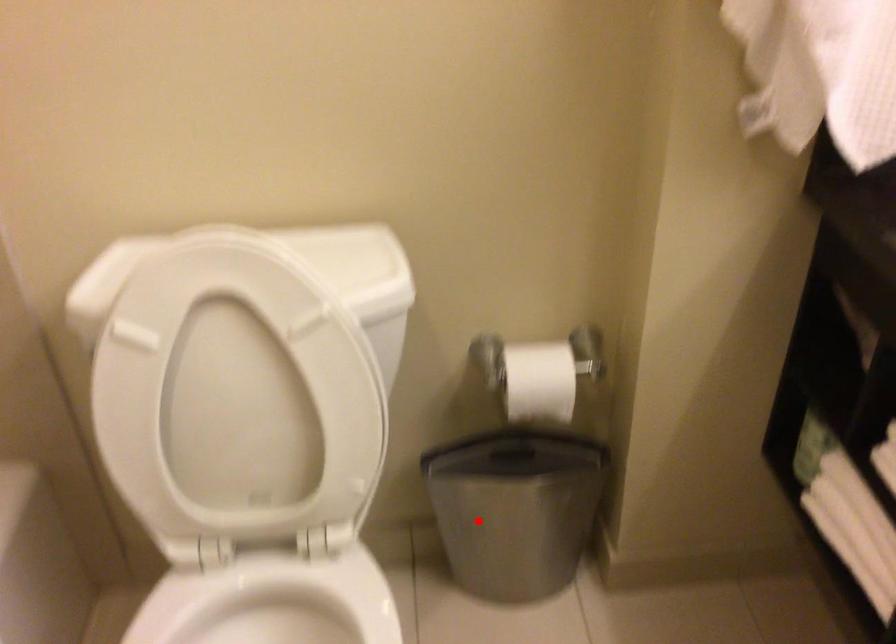
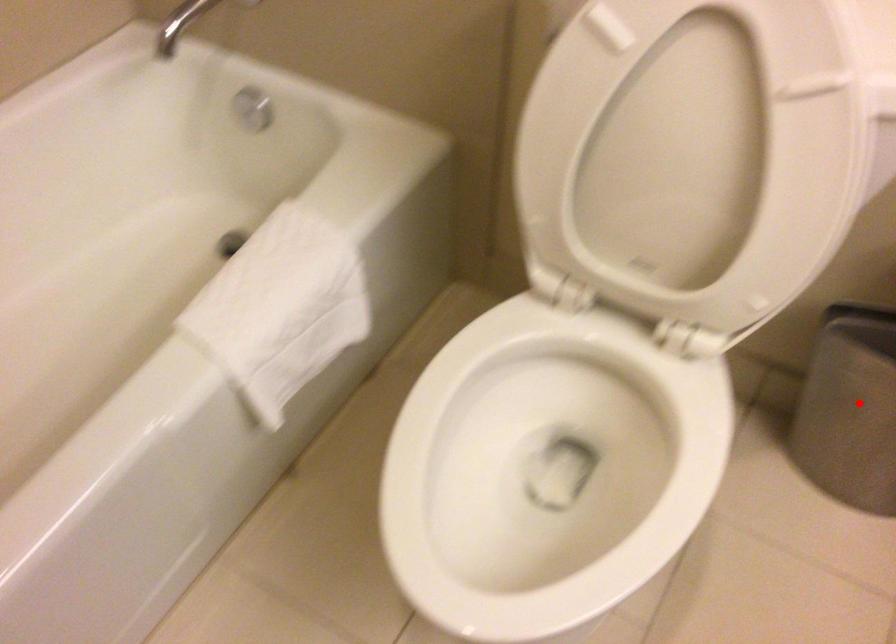
I am providing you with two images of the same scene from different viewpoints. A red point is marked on the first image and another point is marked on the second image. Does the point marked in image1 correspond to the same location as the one in image2?

Yes